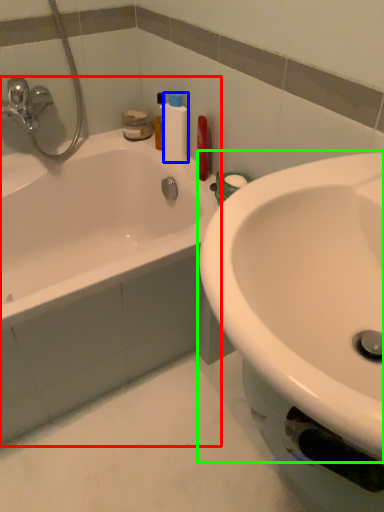
Question: Considering the real-world distances, which object is farthest from bathtub (highlighted by a red box)? cleaning product (highlighted by a blue box) or sink (highlighted by a green box)?

Choices:
 (A) cleaning product
 (B) sink

Answer: (B)